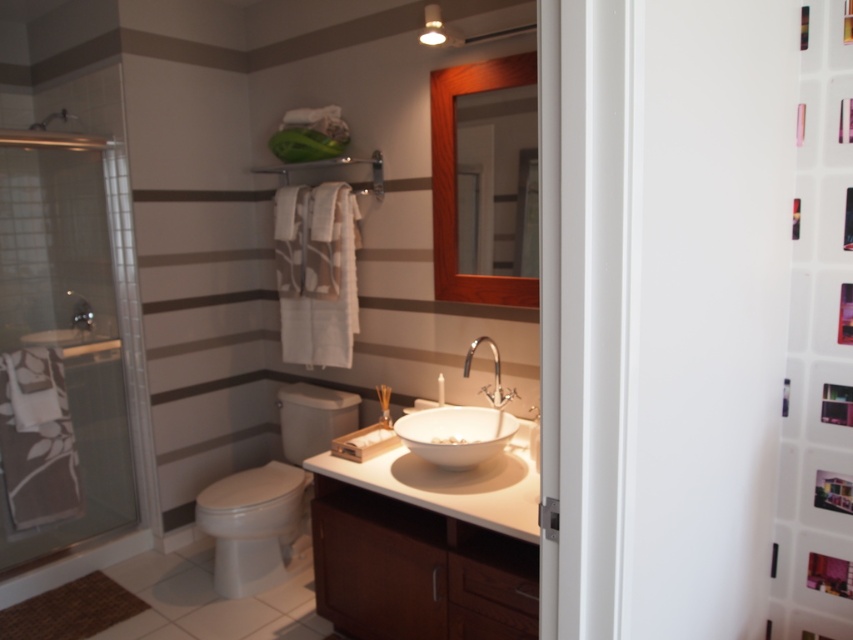
Who is lower down, white glossy screen door at right or wooden mirror at upper center?

Positioned lower is white glossy screen door at right.

Is point (643, 364) positioned before point (521, 74)?

That is True.

The image size is (853, 640). In order to click on white glossy screen door at right in this screenshot , I will do `click(703, 310)`.

Can you confirm if transparent glass shower door at left is positioned below white glossy toilet at center?

No, transparent glass shower door at left is not below white glossy toilet at center.

Does point (138, 342) lie in front of point (329, 426)?

No, it is not.

This screenshot has width=853, height=640. I want to click on transparent glass shower door at left, so click(68, 349).

From the picture: Is wooden mirror at upper center above white ceramic sink at center?

Indeed, wooden mirror at upper center is positioned over white ceramic sink at center.

Who is lower down, wooden mirror at upper center or white ceramic sink at center?

Positioned lower is white ceramic sink at center.

Where is `wooden mirror at upper center`? The width and height of the screenshot is (853, 640). wooden mirror at upper center is located at coordinates (456, 180).